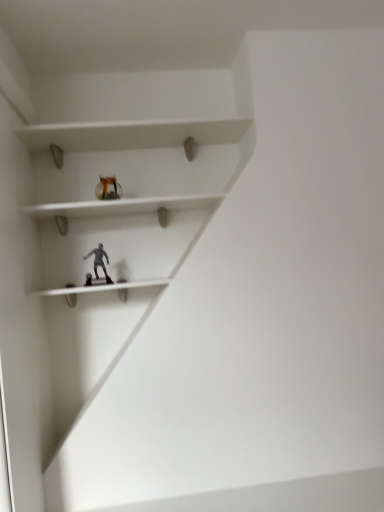
At what (x,y) coordinates should I click in order to perform the action: click on satin silver figurine at center. Please return your answer as a coordinate pair (x, y). Image resolution: width=384 pixels, height=512 pixels. Looking at the image, I should click on (101, 288).

Describe the element at coordinates (101, 288) in the screenshot. The image size is (384, 512). I see `satin silver figurine at center` at that location.

What do you see at coordinates (108, 188) in the screenshot? The width and height of the screenshot is (384, 512). I see `translucent glass vase at upper center` at bounding box center [108, 188].

Where is `translucent glass vase at upper center`? This screenshot has height=512, width=384. translucent glass vase at upper center is located at coordinates (108, 188).

At what (x,y) coordinates should I click in order to perform the action: click on satin silver figurine at center. Please return your answer as a coordinate pair (x, y). Looking at the image, I should click on (101, 288).

Based on their positions, is translucent glass vase at upper center located to the left or right of satin silver figurine at center?

From the image, it's evident that translucent glass vase at upper center is to the right of satin silver figurine at center.

Considering their positions, is translucent glass vase at upper center located in front of or behind satin silver figurine at center?

translucent glass vase at upper center is positioned farther from the viewer than satin silver figurine at center.

Considering the positions of point (100, 177) and point (32, 293), is point (100, 177) closer or farther from the camera than point (32, 293)?

Clearly, point (100, 177) is more distant from the camera than point (32, 293).

From the image's perspective, which one is positioned lower, translucent glass vase at upper center or satin silver figurine at center?

satin silver figurine at center appears lower in the image.

From a real-world perspective, relative to satin silver figurine at center, is translucent glass vase at upper center vertically above or below?

From a real-world perspective, translucent glass vase at upper center is physically above satin silver figurine at center.

Which of these two, translucent glass vase at upper center or satin silver figurine at center, is thinner?

translucent glass vase at upper center.

From their relative heights in the image, would you say translucent glass vase at upper center is taller or shorter than satin silver figurine at center?

Clearly, translucent glass vase at upper center is taller compared to satin silver figurine at center.

Does translucent glass vase at upper center have a larger size compared to satin silver figurine at center?

Incorrect, translucent glass vase at upper center is not larger than satin silver figurine at center.

Do you think translucent glass vase at upper center is within satin silver figurine at center, or outside of it?

translucent glass vase at upper center is not inside satin silver figurine at center, it's outside.

Is the surface of translucent glass vase at upper center in direct contact with satin silver figurine at center?

translucent glass vase at upper center and satin silver figurine at center are not in contact.

Could you tell me if translucent glass vase at upper center is turned towards satin silver figurine at center?

No.

What's the angular difference between translucent glass vase at upper center and satin silver figurine at center's facing directions?

The angular difference between translucent glass vase at upper center and satin silver figurine at center is 1.05 degrees.

I want to click on shelf lying on the left of translucent glass vase at upper center, so click(x=101, y=288).

In the scene shown: Between satin silver figurine at center and translucent glass vase at upper center, which one appears on the left side from the viewer's perspective?

satin silver figurine at center.

Is the position of satin silver figurine at center more distant than that of translucent glass vase at upper center?

No, satin silver figurine at center is closer to the viewer.

Between point (59, 291) and point (116, 192), which one is positioned behind?

Point (116, 192)

From the image's perspective, is satin silver figurine at center positioned above or below translucent glass vase at upper center?

satin silver figurine at center is situated lower than translucent glass vase at upper center in the image.

From a real-world perspective, which object stands above the other?

In real-world perspective, translucent glass vase at upper center is above.

In terms of width, does satin silver figurine at center look wider or thinner when compared to translucent glass vase at upper center?

In the image, satin silver figurine at center appears to be wider than translucent glass vase at upper center.

Considering the sizes of objects satin silver figurine at center and translucent glass vase at upper center in the image provided, who is taller, satin silver figurine at center or translucent glass vase at upper center?

translucent glass vase at upper center is taller.

Between satin silver figurine at center and translucent glass vase at upper center, which one has smaller size?

translucent glass vase at upper center is smaller.

Is satin silver figurine at center outside of translucent glass vase at upper center?

Yes, satin silver figurine at center is not within translucent glass vase at upper center.

Are satin silver figurine at center and translucent glass vase at upper center far apart?

satin silver figurine at center is actually quite close to translucent glass vase at upper center.

Is satin silver figurine at center oriented towards translucent glass vase at upper center?

No, satin silver figurine at center does not turn towards translucent glass vase at upper center.

I want to click on shelf on the left of translucent glass vase at upper center, so click(x=101, y=288).

At what (x,y) coordinates should I click in order to perform the action: click on toy behind the satin silver figurine at center. Please return your answer as a coordinate pair (x, y). The image size is (384, 512). Looking at the image, I should click on (108, 188).

This screenshot has width=384, height=512. I want to click on toy on the right of the satin silver figurine at center, so click(x=108, y=188).